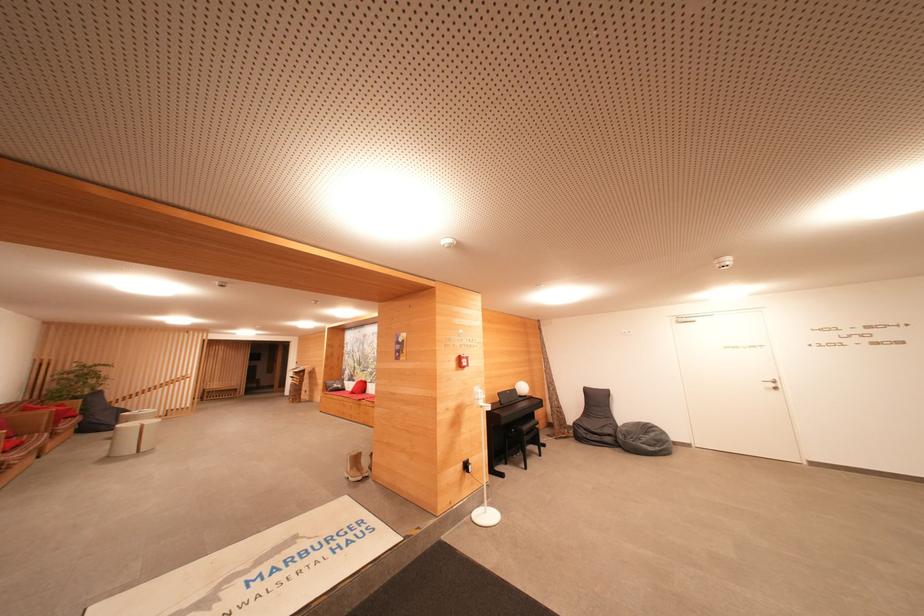
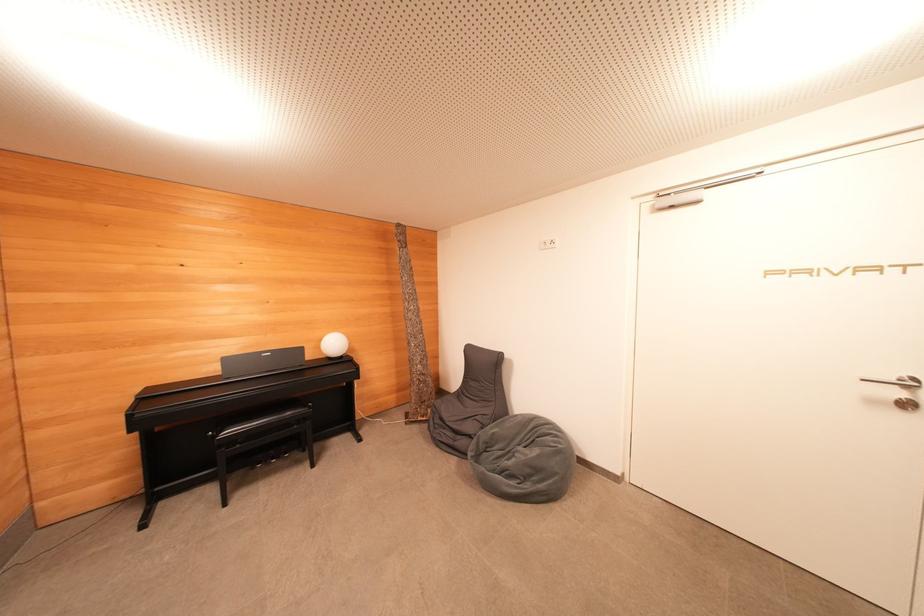
Where in the second image is the point corresponding to [527,391] from the first image?

(337, 347)